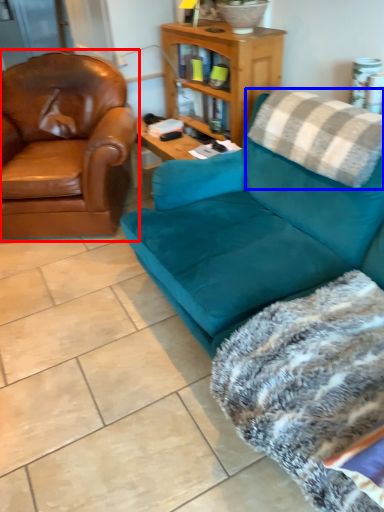
Question: Which object is closer to the camera taking this photo, chair (highlighted by a red box) or pillow (highlighted by a blue box)?

Choices:
 (A) chair
 (B) pillow

Answer: (B)